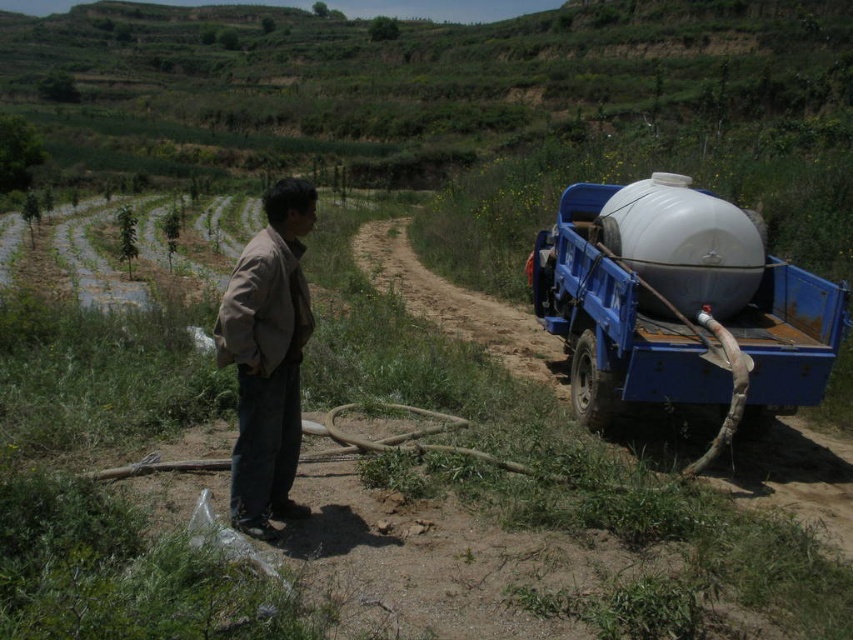
Question: Which of the following is the closest to the observer?

Choices:
 (A) white glossy tank at right
 (B) white matte water tank at right
 (C) brown cotton jacket at center

Answer: (C)

Question: Is brown cotton jacket at center below white matte water tank at right?

Choices:
 (A) yes
 (B) no

Answer: (A)

Question: Which object is farther from the camera taking this photo?

Choices:
 (A) white glossy tank at right
 (B) brown cotton jacket at center
 (C) white matte water tank at right

Answer: (C)

Question: Does brown cotton jacket at center appear on the left side of white matte water tank at right?

Choices:
 (A) no
 (B) yes

Answer: (B)

Question: Which object is positioned farthest from the white glossy tank at right?

Choices:
 (A) white matte water tank at right
 (B) brown cotton jacket at center

Answer: (B)

Question: Is brown cotton jacket at center bigger than white matte water tank at right?

Choices:
 (A) yes
 (B) no

Answer: (B)